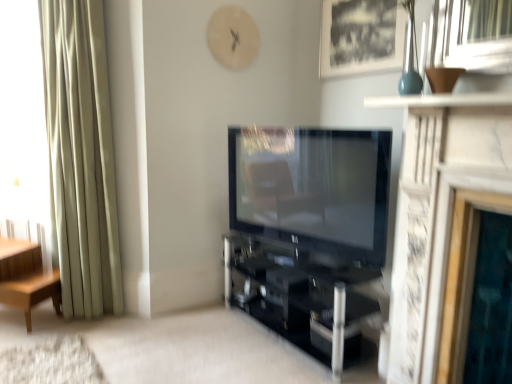
Question: Is black matte picture frame at upper center thinner than black glass shelf at center?

Choices:
 (A) yes
 (B) no

Answer: (A)

Question: From a real-world perspective, is black matte picture frame at upper center physically below black glass shelf at center?

Choices:
 (A) no
 (B) yes

Answer: (A)

Question: Considering the relative sizes of black matte picture frame at upper center and black glass shelf at center in the image provided, is black matte picture frame at upper center taller than black glass shelf at center?

Choices:
 (A) yes
 (B) no

Answer: (A)

Question: Can you confirm if black matte picture frame at upper center is bigger than black glass shelf at center?

Choices:
 (A) no
 (B) yes

Answer: (A)

Question: Is black matte picture frame at upper center shorter than black glass shelf at center?

Choices:
 (A) yes
 (B) no

Answer: (B)

Question: Could black glass shelf at center be considered to be inside black matte picture frame at upper center?

Choices:
 (A) yes
 (B) no

Answer: (B)

Question: Does black matte picture frame at upper center have a greater height compared to matte black tv at center?

Choices:
 (A) no
 (B) yes

Answer: (A)

Question: Is black matte picture frame at upper center in contact with matte black tv at center?

Choices:
 (A) no
 (B) yes

Answer: (A)

Question: Is black matte picture frame at upper center to the right of matte black tv at center from the viewer's perspective?

Choices:
 (A) yes
 (B) no

Answer: (A)

Question: Is black matte picture frame at upper center behind matte black tv at center?

Choices:
 (A) yes
 (B) no

Answer: (A)

Question: Would you consider black matte picture frame at upper center to be distant from matte black tv at center?

Choices:
 (A) no
 (B) yes

Answer: (A)

Question: Considering the relative sizes of black matte picture frame at upper center and matte black tv at center in the image provided, is black matte picture frame at upper center shorter than matte black tv at center?

Choices:
 (A) no
 (B) yes

Answer: (B)

Question: Is black glass shelf at center closer to the viewer compared to light brown wood side table at left?

Choices:
 (A) yes
 (B) no

Answer: (A)